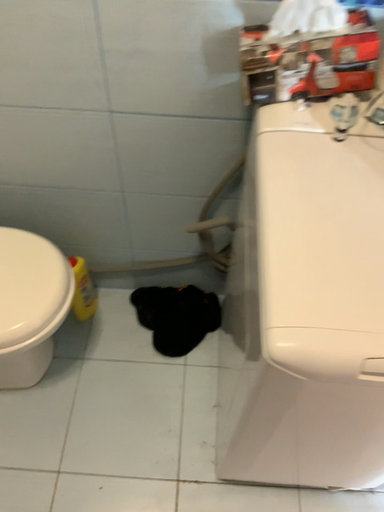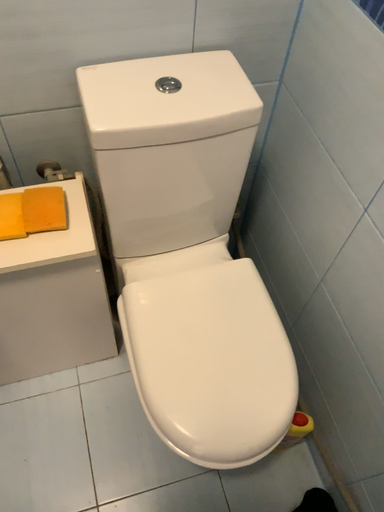
Question: Which way did the camera rotate in the video?

Choices:
 (A) rotated left
 (B) rotated right

Answer: (A)